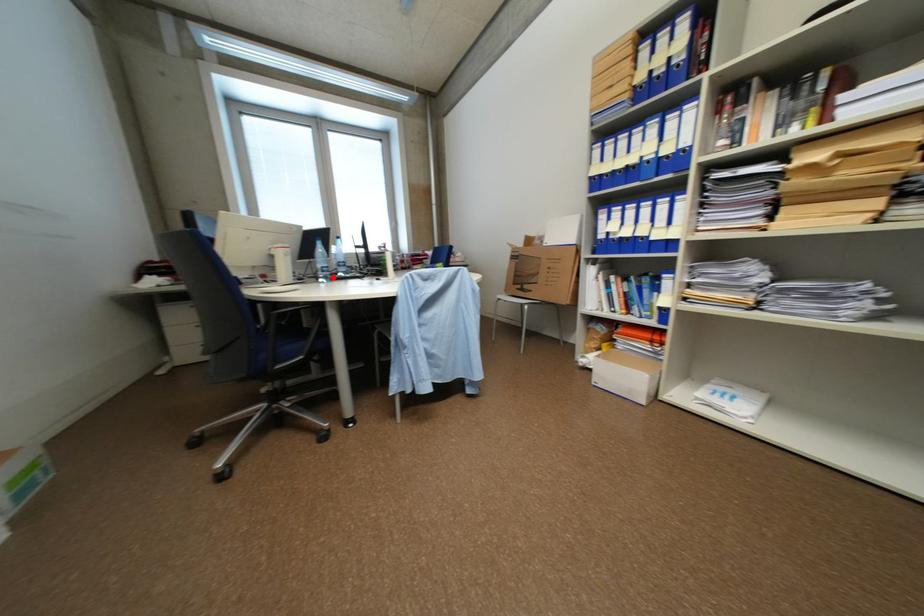
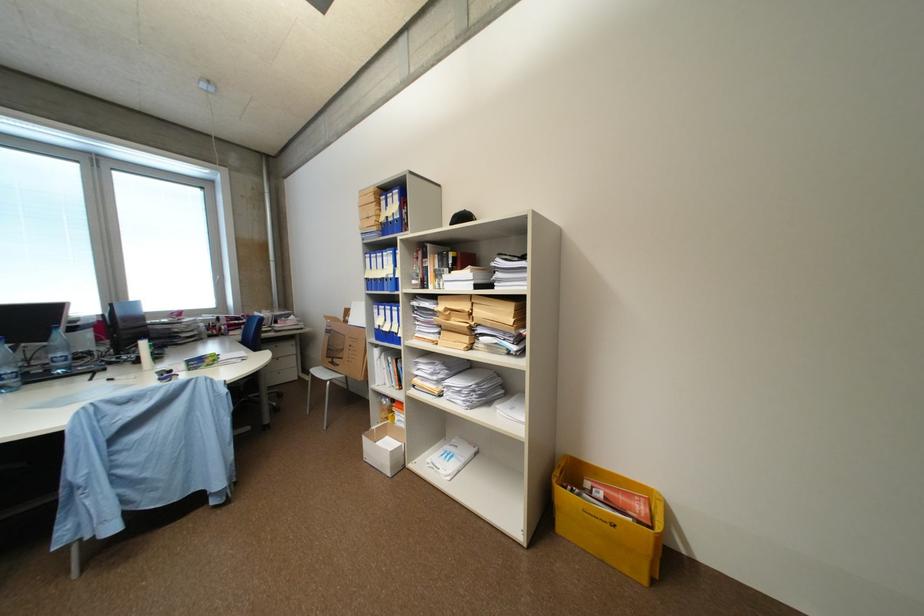
The point at the highlighted location is marked in the first image. Where is the corresponding point in the second image?

(10, 389)